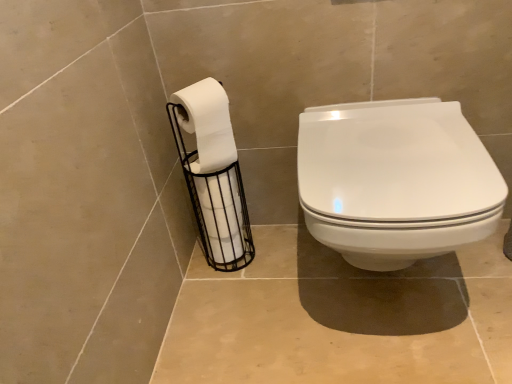
Question: From a real-world perspective, is white glossy toilet seat at center physically above white matte toilet paper at left, which ranks as the second toilet paper in bottom-to-top order?

Choices:
 (A) no
 (B) yes

Answer: (A)

Question: From the image's perspective, is white glossy toilet seat at center on top of white matte toilet paper at left, which appears as the 1th toilet paper when viewed from the top?

Choices:
 (A) yes
 (B) no

Answer: (B)

Question: Is the position of white glossy toilet seat at center less distant than that of white matte toilet paper at left, which appears as the 1th toilet paper when viewed from the top?

Choices:
 (A) yes
 (B) no

Answer: (A)

Question: Are white glossy toilet seat at center and white matte toilet paper at left, which appears as the 1th toilet paper when viewed from the top, beside each other?

Choices:
 (A) yes
 (B) no

Answer: (B)

Question: Can you confirm if white glossy toilet seat at center is positioned to the left of white matte toilet paper at left, which ranks as the second toilet paper in bottom-to-top order?

Choices:
 (A) no
 (B) yes

Answer: (A)

Question: From the image's perspective, would you say white glossy toilet seat at center is shown under white matte toilet paper at left, which appears as the 1th toilet paper when viewed from the top?

Choices:
 (A) yes
 (B) no

Answer: (A)

Question: Is white matte toilet paper at left, which ranks as the second toilet paper in bottom-to-top order, looking in the opposite direction of white glossy toilet seat at center?

Choices:
 (A) yes
 (B) no

Answer: (B)

Question: Is white matte toilet paper at left, which appears as the 1th toilet paper when viewed from the top, positioned before white glossy toilet seat at center?

Choices:
 (A) no
 (B) yes

Answer: (A)

Question: Can you confirm if white matte toilet paper at left, which appears as the 1th toilet paper when viewed from the top, is smaller than white glossy toilet seat at center?

Choices:
 (A) no
 (B) yes

Answer: (B)

Question: From the image's perspective, is white matte toilet paper at left, which ranks as the second toilet paper in bottom-to-top order, above white glossy toilet seat at center?

Choices:
 (A) yes
 (B) no

Answer: (A)

Question: Considering the relative sizes of white matte toilet paper at left, which appears as the 1th toilet paper when viewed from the top, and white glossy toilet seat at center in the image provided, is white matte toilet paper at left, which appears as the 1th toilet paper when viewed from the top, thinner than white glossy toilet seat at center?

Choices:
 (A) no
 (B) yes

Answer: (B)

Question: Would you say white matte toilet paper at left, which appears as the 1th toilet paper when viewed from the top, contains white glossy toilet seat at center?

Choices:
 (A) yes
 (B) no

Answer: (B)

Question: Is the depth of white matte toilet paper at left, marked as the 2th toilet paper in a top-to-bottom arrangement, greater than that of white matte toilet paper at left, which ranks as the second toilet paper in bottom-to-top order?

Choices:
 (A) no
 (B) yes

Answer: (B)